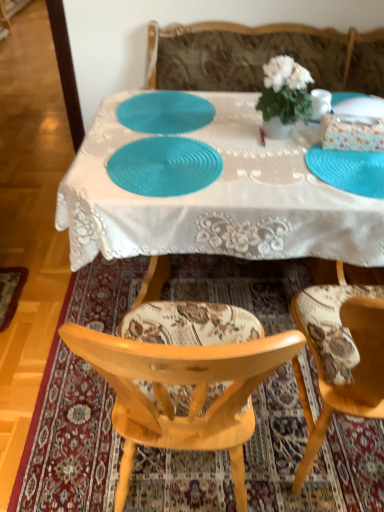
Question: Is teal textured plate at center, acting as the second plate starting from the right, surrounding blue textured placemat at center, the 1th plate positioned from the left?

Choices:
 (A) no
 (B) yes

Answer: (A)

Question: Is teal textured plate at center, acting as the second plate starting from the right, positioned beyond the bounds of blue textured placemat at center, the 1th plate positioned from the left?

Choices:
 (A) yes
 (B) no

Answer: (A)

Question: From the image's perspective, is teal textured plate at center, acting as the second plate starting from the right, located above blue textured placemat at center, which is counted as the 3th plate, starting from the right?

Choices:
 (A) yes
 (B) no

Answer: (B)

Question: Is teal textured plate at center, acting as the 2th plate starting from the left, shorter than blue textured placemat at center, the 1th plate positioned from the left?

Choices:
 (A) no
 (B) yes

Answer: (A)

Question: Would you consider teal textured plate at center, acting as the second plate starting from the right, to be distant from blue textured placemat at center, which is counted as the 3th plate, starting from the right?

Choices:
 (A) yes
 (B) no

Answer: (B)

Question: Is blue textured placemat at center, the 1th plate positioned from the left, to the left or to the right of white matte flower pot at center in the image?

Choices:
 (A) right
 (B) left

Answer: (B)

Question: From a real-world perspective, is blue textured placemat at center, the 1th plate positioned from the left, positioned above or below white matte flower pot at center?

Choices:
 (A) above
 (B) below

Answer: (B)

Question: From the image's perspective, is blue textured placemat at center, the 1th plate positioned from the left, located above or below white matte flower pot at center?

Choices:
 (A) above
 (B) below

Answer: (A)

Question: Is blue textured placemat at center, the 1th plate positioned from the left, wider or thinner than white matte flower pot at center?

Choices:
 (A) thin
 (B) wide

Answer: (B)

Question: In the image, is floral fabric chair at lower center on the left side or the right side of blue rubber placemat at lower right, the 1th plate viewed from the right?

Choices:
 (A) right
 (B) left

Answer: (B)

Question: From the image's perspective, relative to blue rubber placemat at lower right, the 1th plate viewed from the right, is floral fabric chair at lower center above or below?

Choices:
 (A) above
 (B) below

Answer: (B)

Question: Is point (132, 484) closer or farther from the camera than point (350, 156)?

Choices:
 (A) closer
 (B) farther

Answer: (A)

Question: Is floral fabric chair at lower center spatially inside blue rubber placemat at lower right, the 1th plate viewed from the right, or outside of it?

Choices:
 (A) inside
 (B) outside

Answer: (B)

Question: Do you think patterned fabric chair at center is within white matte flower pot at center, or outside of it?

Choices:
 (A) inside
 (B) outside

Answer: (B)

Question: Considering the positions of patterned fabric chair at center and white matte flower pot at center in the image, is patterned fabric chair at center taller or shorter than white matte flower pot at center?

Choices:
 (A) tall
 (B) short

Answer: (A)